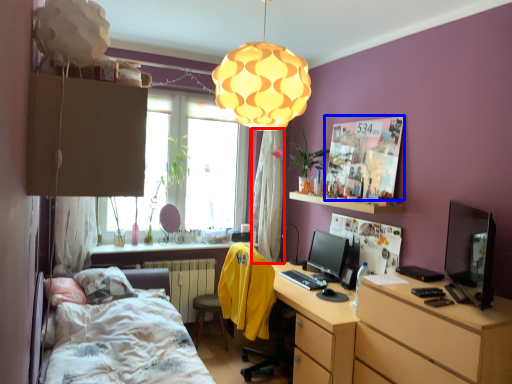
Question: Which of the following is the closest to the observer, curtain (highlighted by a red box) or poster page (highlighted by a blue box)?

Choices:
 (A) curtain
 (B) poster page

Answer: (B)